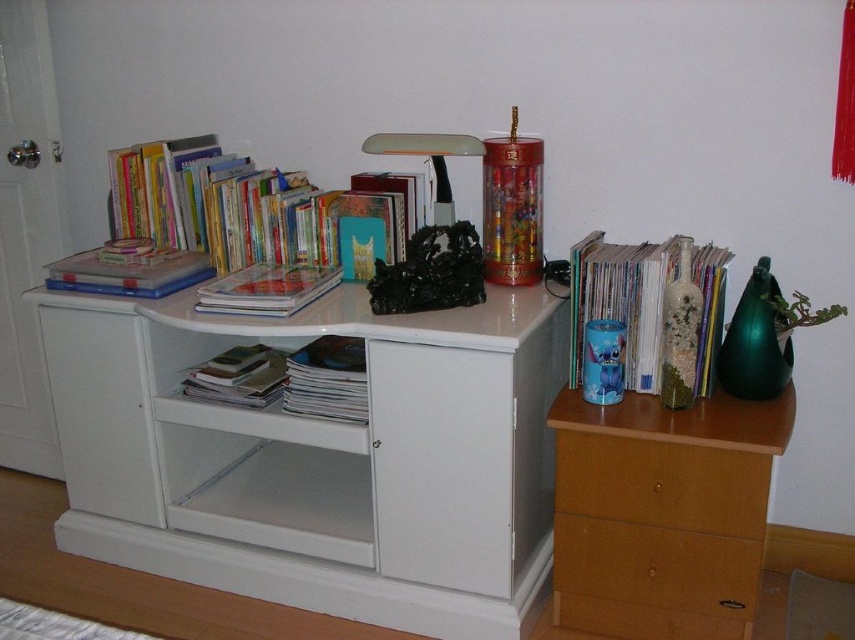
You are organizing your desk and need to place a tall plant that requires a stable base. Which drawer, the wooden drawer at right or the wooden drawer at lower right, would you choose to place the plant to ensure it stays upright?

The wooden drawer at right is taller than the wooden drawer at lower right, so placing the tall plant on the wooden drawer at right would provide a more stable base due to its height, helping the plant stay upright.

You are organizing the desk area and want to place a new item between the hardcover books at upper left and the wooden drawer at lower right. Based on their widths, which object should you place closer to the middle to ensure the new item fits properly?

The hardcover books at upper left might be wider than the wooden drawer at lower right, so placing the books closer to the middle would leave enough space for the new item between them.

Please describe the location of the brown matte drawer at lower right in the room using coordinates. The coordinate system has the origin at the bottom left corner of the room, with x increasing to the right and y increasing upwards. The maximum x is 1.0 and maximum y is 1.0.

The brown matte drawer at lower right is located at coordinates point (656, 564).